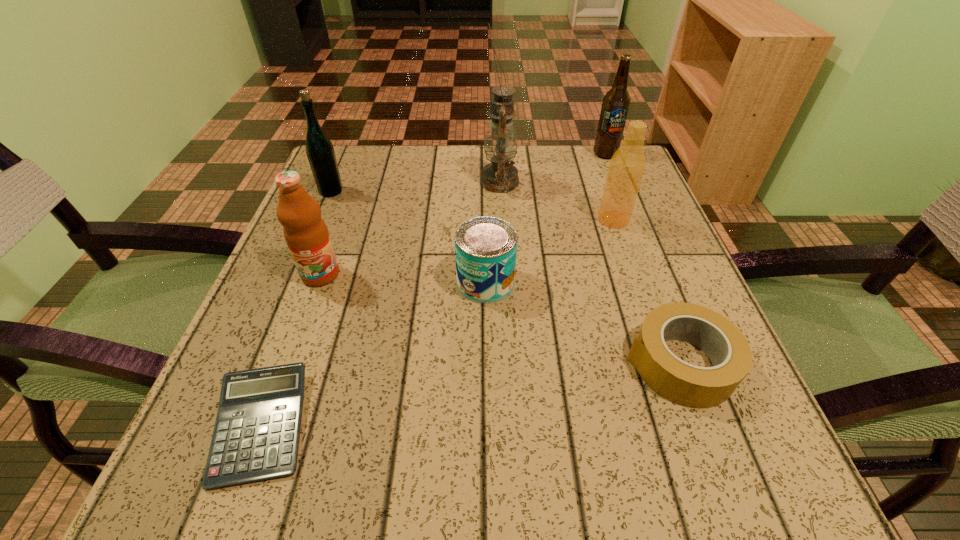
In the image, there is a desktop. Identify the location of vacant space at the right edge. (647, 256).

Find the location of `free region at the far left corner of the desktop`. free region at the far left corner of the desktop is located at coordinates (384, 152).

At what (x,y) coordinates should I click in order to perform the action: click on vacant space at the near left corner of the desktop. Please return your answer as a coordinate pair (x, y). This screenshot has width=960, height=540. Looking at the image, I should click on (313, 440).

The image size is (960, 540). I want to click on vacant space at the near right corner of the desktop, so click(784, 472).

The image size is (960, 540). I want to click on free space between the fourth farthest object and the duct tape, so [646, 292].

Find the location of a particular element. This screenshot has width=960, height=540. free space between the nearest beer bottle and the can is located at coordinates (549, 251).

Locate an element on the screen. free space between the seventh tallest object and the can is located at coordinates (583, 323).

You are a GUI agent. You are given a task and a screenshot of the screen. Output one action in this format:
    pyautogui.click(x=<x>, y=<y>)
    Task: Click on the vacant area that lies between the calculator and the tallest object
    
    Given the screenshot: What is the action you would take?
    pyautogui.click(x=380, y=303)

The image size is (960, 540). In order to click on free point between the fourth farthest object and the can in this screenshot , I will do `click(549, 251)`.

You are a GUI agent. You are given a task and a screenshot of the screen. Output one action in this format:
    pyautogui.click(x=<x>, y=<y>)
    Task: Click on the vacant space that is in between the farthest beer bottle and the sixth tallest object
    This screenshot has height=540, width=960.
    Given the screenshot: What is the action you would take?
    pyautogui.click(x=545, y=218)